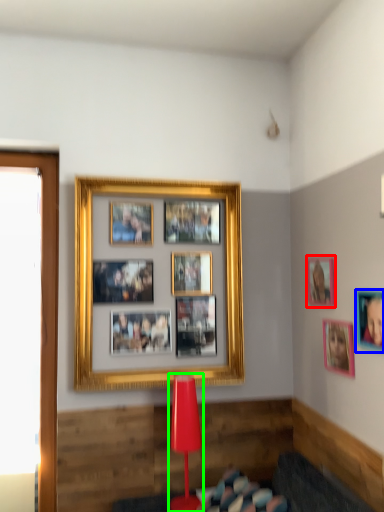
Question: Based on their relative distances, which object is farther from picture frame (highlighted by a red box)? Choose from picture frame (highlighted by a blue box) and table lamp (highlighted by a green box).

Choices:
 (A) picture frame
 (B) table lamp

Answer: (B)